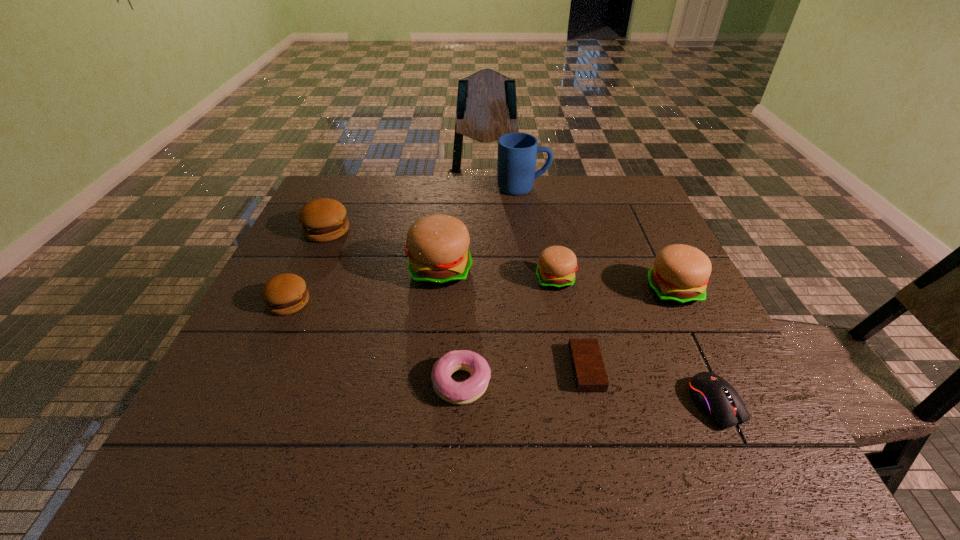
I want to click on blank space located 0.380m on the back of the second beige hamburger from right to left, so click(x=539, y=192).

At what (x,y) coordinates should I click in order to perform the action: click on free space located on the front of the smaller brown hamburger. Please return your answer as a coordinate pair (x, y). This screenshot has height=540, width=960. Looking at the image, I should click on (238, 410).

Image resolution: width=960 pixels, height=540 pixels. Identify the location of vacant region located 0.280m on the left of the black computer mouse. (544, 404).

Find the location of a particular element. This screenshot has height=540, width=960. vacant region located on the back of the doughnut is located at coordinates (467, 260).

You are a GUI agent. You are given a task and a screenshot of the screen. Output one action in this format:
    pyautogui.click(x=<x>, y=<y>)
    Task: Click on the vacant region located on the front face of the black alarm clock
    
    Given the screenshot: What is the action you would take?
    pyautogui.click(x=508, y=369)

Locate an element on the screen. free space located 0.270m on the front face of the black alarm clock is located at coordinates (439, 369).

This screenshot has width=960, height=540. I want to click on vacant space located on the front face of the black alarm clock, so click(x=483, y=369).

Locate an element on the screen. The width and height of the screenshot is (960, 540). object positioned at the far edge is located at coordinates (517, 152).

You are a GUI agent. You are given a task and a screenshot of the screen. Output one action in this format:
    pyautogui.click(x=<x>, y=<y>)
    Task: Click on the object situated at the near edge
    
    Given the screenshot: What is the action you would take?
    pyautogui.click(x=711, y=393)

In order to click on hamburger situated at the right edge in this screenshot , I will do `click(680, 274)`.